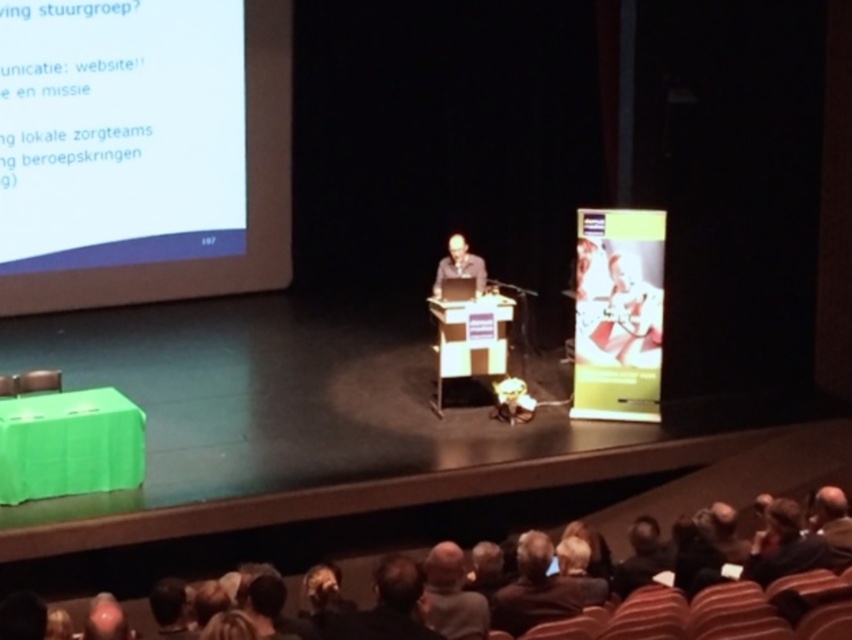
Which is behind, point (502, 611) or point (829, 540)?

Positioned behind is point (829, 540).

Does brown leather jacket at lower center have a lesser width compared to brown leather jacket at center?

Incorrect, brown leather jacket at lower center's width is not less than brown leather jacket at center's.

Who is more distant from viewer, (521, 577) or (813, 525)?

Point (813, 525)

Where is `brown leather jacket at lower center`? brown leather jacket at lower center is located at coordinates (533, 589).

Who is higher up, white matte projector screen at upper left or dark brown hair at lower center?

white matte projector screen at upper left

Which is in front, point (279, 164) or point (459, 596)?

Point (459, 596) is in front.

You are a GUI agent. You are given a task and a screenshot of the screen. Output one action in this format:
    pyautogui.click(x=<x>, y=<y>)
    Task: Click on the white matte projector screen at upper left
    
    Given the screenshot: What is the action you would take?
    pyautogui.click(x=142, y=150)

Between brown leather jacket at lower center and dark gray shirt at center, which one is positioned lower?

brown leather jacket at lower center is lower down.

Is brown leather jacket at lower center bigger than dark gray shirt at center?

No.

Who is more distant from viewer, (x=540, y=536) or (x=445, y=275)?

Point (x=445, y=275)

In order to click on brown leather jacket at lower center in this screenshot , I will do `click(533, 589)`.